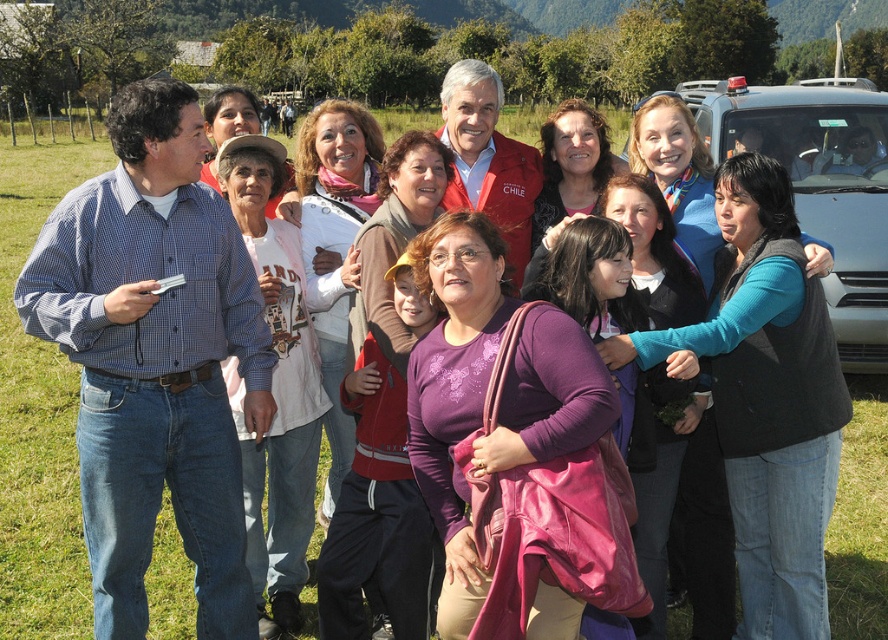
Is blue checkered shirt at left wider than metallic silver car at right?

No, blue checkered shirt at left is not wider than metallic silver car at right.

Is blue checkered shirt at left above metallic silver car at right?

Actually, blue checkered shirt at left is below metallic silver car at right.

The width and height of the screenshot is (888, 640). I want to click on blue checkered shirt at left, so click(x=155, y=358).